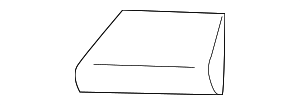
Image resolution: width=300 pixels, height=105 pixels. In order to click on corner in this screenshot , I will do point(121,10), point(222,13), point(221,93), point(78,90).